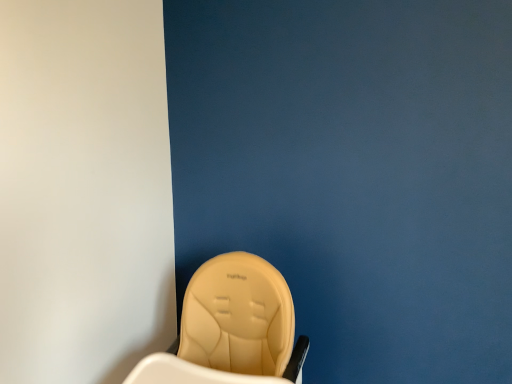
The width and height of the screenshot is (512, 384). What do you see at coordinates (231, 328) in the screenshot?
I see `beige leather high chair at lower left` at bounding box center [231, 328].

What is the approximate width of beige leather high chair at lower left?

The width of beige leather high chair at lower left is 20.32 inches.

You are a GUI agent. You are given a task and a screenshot of the screen. Output one action in this format:
    pyautogui.click(x=<x>, y=<y>)
    Task: Click on the beige leather high chair at lower left
    
    Given the screenshot: What is the action you would take?
    pyautogui.click(x=231, y=328)

Where is `beige leather high chair at lower left`? beige leather high chair at lower left is located at coordinates (231, 328).